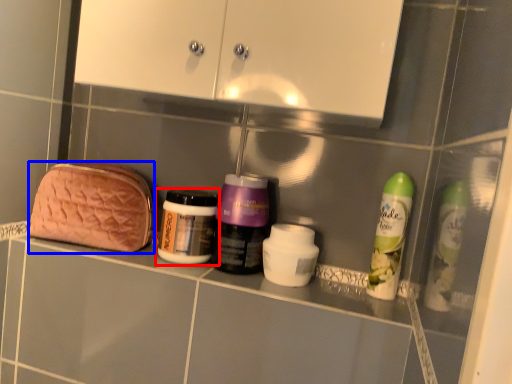
Question: Which object appears closest to the camera in this image, bottle (highlighted by a red box) or pouch (highlighted by a blue box)?

Choices:
 (A) bottle
 (B) pouch

Answer: (A)